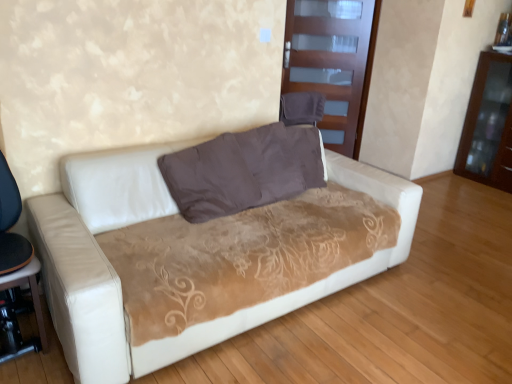
Question: From a real-world perspective, is transparent glass door at upper center below brown suede pillow at center?

Choices:
 (A) yes
 (B) no

Answer: (B)

Question: Can you confirm if transparent glass door at upper center is positioned to the right of brown suede pillow at center?

Choices:
 (A) yes
 (B) no

Answer: (A)

Question: Is transparent glass door at upper center in contact with brown suede pillow at center?

Choices:
 (A) no
 (B) yes

Answer: (A)

Question: Is transparent glass door at upper center aimed at brown suede pillow at center?

Choices:
 (A) yes
 (B) no

Answer: (A)

Question: Does transparent glass door at upper center have a greater height compared to brown suede pillow at center?

Choices:
 (A) yes
 (B) no

Answer: (A)

Question: In terms of height, does transparent glass door at upper center look taller or shorter compared to brown glossy dresser at right?

Choices:
 (A) short
 (B) tall

Answer: (B)

Question: From the image's perspective, relative to brown glossy dresser at right, is transparent glass door at upper center above or below?

Choices:
 (A) below
 (B) above

Answer: (B)

Question: From a real-world perspective, relative to brown glossy dresser at right, is transparent glass door at upper center vertically above or below?

Choices:
 (A) above
 (B) below

Answer: (A)

Question: Is transparent glass door at upper center in front of or behind brown glossy dresser at right in the image?

Choices:
 (A) behind
 (B) front

Answer: (A)

Question: Based on their positions, is brown glossy dresser at right located to the left or right of black plastic table at lower left?

Choices:
 (A) right
 (B) left

Answer: (A)

Question: From the image's perspective, relative to black plastic table at lower left, is brown glossy dresser at right above or below?

Choices:
 (A) above
 (B) below

Answer: (A)

Question: In the image, is brown glossy dresser at right positioned in front of or behind black plastic table at lower left?

Choices:
 (A) behind
 (B) front

Answer: (A)

Question: Based on their sizes in the image, would you say brown glossy dresser at right is bigger or smaller than black plastic table at lower left?

Choices:
 (A) big
 (B) small

Answer: (A)

Question: Visually, is brown glossy dresser at right positioned to the left or to the right of transparent glass door at upper center?

Choices:
 (A) left
 (B) right

Answer: (B)

Question: Is point (479, 130) positioned closer to the camera than point (303, 51)?

Choices:
 (A) farther
 (B) closer

Answer: (A)